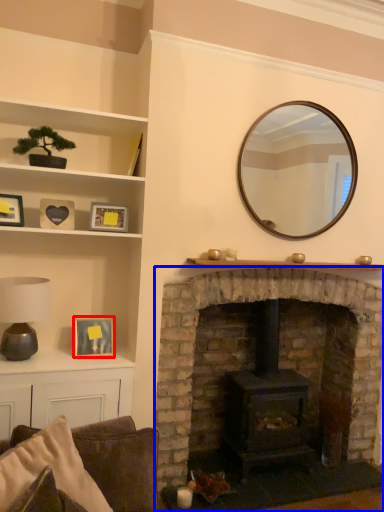
Question: Which of the following is the farthest to the observer, picture frame (highlighted by a red box) or fireplace (highlighted by a blue box)?

Choices:
 (A) picture frame
 (B) fireplace

Answer: (A)